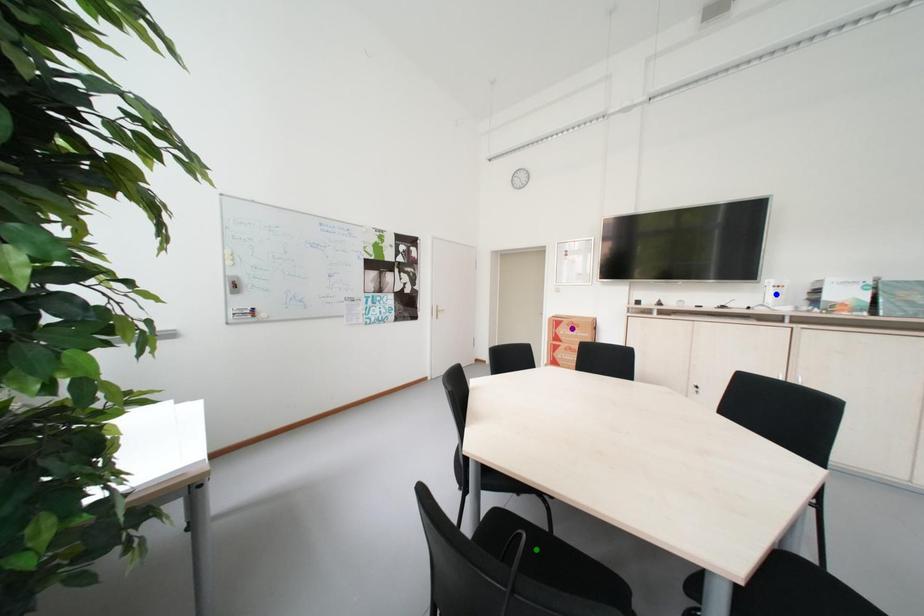
Order these from farthest to nearest:
A) purple point
B) blue point
C) green point

purple point, blue point, green point